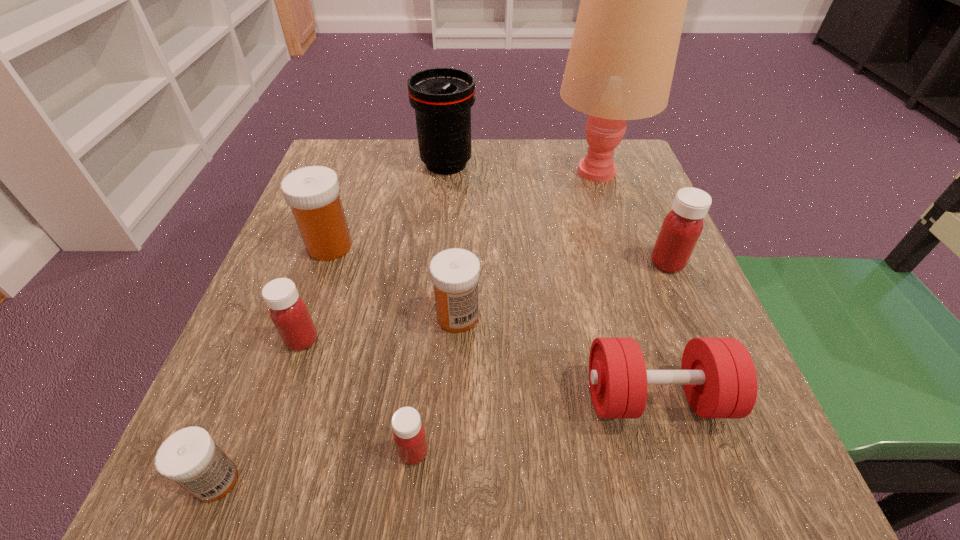
Locate an element on the screen. The image size is (960, 540). the leftmost red medicine is located at coordinates 288,312.

You are a GUI agent. You are given a task and a screenshot of the screen. Output one action in this format:
    pyautogui.click(x=<x>, y=<y>)
    Task: Click on the third nearest object
    Image resolution: width=960 pixels, height=540 pixels.
    Given the screenshot: What is the action you would take?
    pyautogui.click(x=718, y=375)

Where is `the smallest red medicine`? The height and width of the screenshot is (540, 960). the smallest red medicine is located at coordinates (409, 435).

Where is `the second red medicine from left to right`? The height and width of the screenshot is (540, 960). the second red medicine from left to right is located at coordinates (409, 435).

Locate an element on the screen. The image size is (960, 540). the smallest white medicine is located at coordinates (190, 457).

The height and width of the screenshot is (540, 960). I want to click on vacant space located on the front of the tallest object, so click(618, 234).

Locate an element on the screen. The height and width of the screenshot is (540, 960). free space located 0.060m on the left of the black telephoto lens is located at coordinates (392, 164).

Identify the location of free space located on the front of the biggest white medicine. The height and width of the screenshot is (540, 960). (251, 471).

Find the location of a particular element. This screenshot has width=960, height=540. blank space located 0.150m on the left of the rightmost medicine is located at coordinates (569, 263).

Image resolution: width=960 pixels, height=540 pixels. Identify the location of vacant position located on the front of the rightmost white medicine. (454, 403).